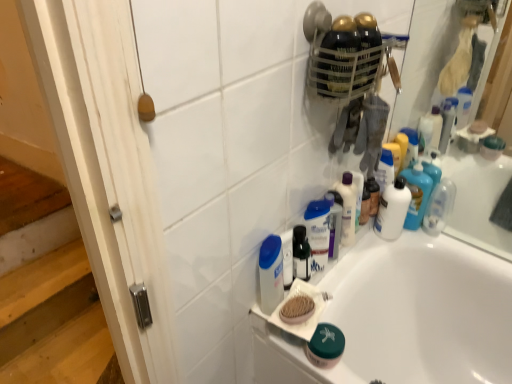
Question: Is clear plastic bottle at upper right, which is counted as the first toiletry, starting from the right, taller or shorter than white glossy lotion at upper center, marked as the second toiletry in a left-to-right arrangement?

Choices:
 (A) tall
 (B) short

Answer: (B)

Question: Is clear plastic bottle at upper right, which is counted as the first toiletry, starting from the right, wider or thinner than white glossy lotion at upper center, marked as the second toiletry in a left-to-right arrangement?

Choices:
 (A) thin
 (B) wide

Answer: (B)

Question: Estimate the real-world distances between objects in this image. Which object is closer to the white plastic mouthwash at center, the first mouthwash from the front?

Choices:
 (A) wooden brush at upper right
 (B) white glossy bottle at upper right, the first mouthwash viewed from the right
 (C) translucent plastic bottles at upper right, the second toiletry from the right
 (D) green matte jar at lower center, which appears as the first toiletry when viewed from the left
 (E) white wood screen door at left

Answer: (A)

Question: Which object is the closest to the white glossy bathtub at lower center?

Choices:
 (A) translucent plastic bottles at upper right, which is the third toiletry from left to right
 (B) white glossy bottle at upper right, acting as the 3th mouthwash starting from the left
 (C) white wood screen door at left
 (D) translucent plastic mouthwash at center, arranged as the second mouthwash when viewed from the left
 (E) white plastic mouthwash at center, the 3th mouthwash in the back-to-front sequence

Answer: (B)